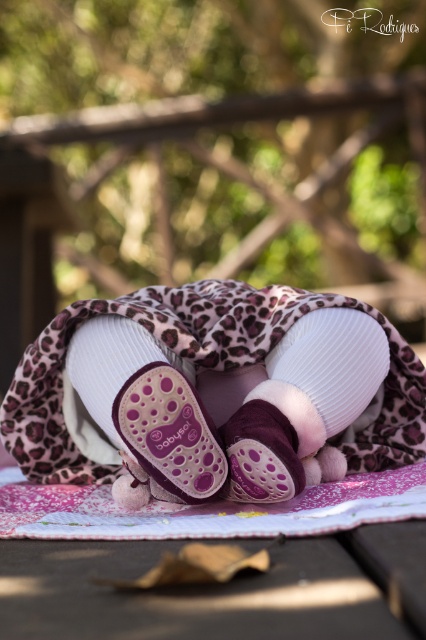
From the picture: Who is positioned more to the left, white ribbed sock at center or purple suede booties at center?

purple suede booties at center

Is point (336, 362) more distant than point (284, 428)?

That is True.

Which is in front, point (304, 333) or point (293, 428)?

Point (293, 428)

Where is `white ribbed sock at center`? The width and height of the screenshot is (426, 640). white ribbed sock at center is located at coordinates (333, 362).

Consider the image. Who is higher up, purple suede baby bootie at center or white ribbed sock at center?

white ribbed sock at center is higher up.

You are a GUI agent. You are given a task and a screenshot of the screen. Output one action in this format:
    pyautogui.click(x=<x>, y=<y>)
    Task: Click on the purple suede baby bootie at center
    
    Given the screenshot: What is the action you would take?
    pyautogui.click(x=167, y=436)

Is point (118, 432) farther from camera compared to point (301, 360)?

That is False.

I want to click on purple suede baby bootie at center, so click(x=167, y=436).

Can you confirm if leopard print fabric at center is thinner than purple suede booties at center?

Incorrect, leopard print fabric at center's width is not less than purple suede booties at center's.

Between leopard print fabric at center and purple suede booties at center, which one is positioned higher?

leopard print fabric at center

The image size is (426, 640). What do you see at coordinates (203, 368) in the screenshot?
I see `leopard print fabric at center` at bounding box center [203, 368].

This screenshot has height=640, width=426. Identify the location of leopard print fabric at center. (203, 368).